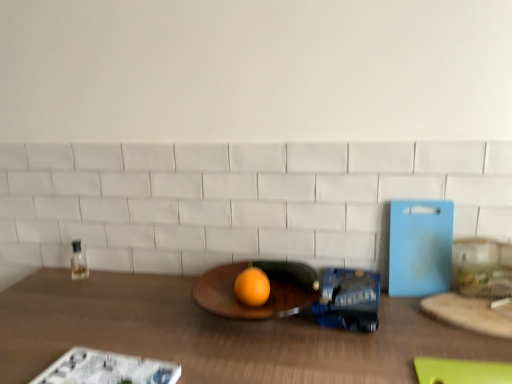
Locate an element on the screen. The height and width of the screenshot is (384, 512). vacant location below wooden cutting board at right (from a real-world perspective) is located at coordinates (470, 315).